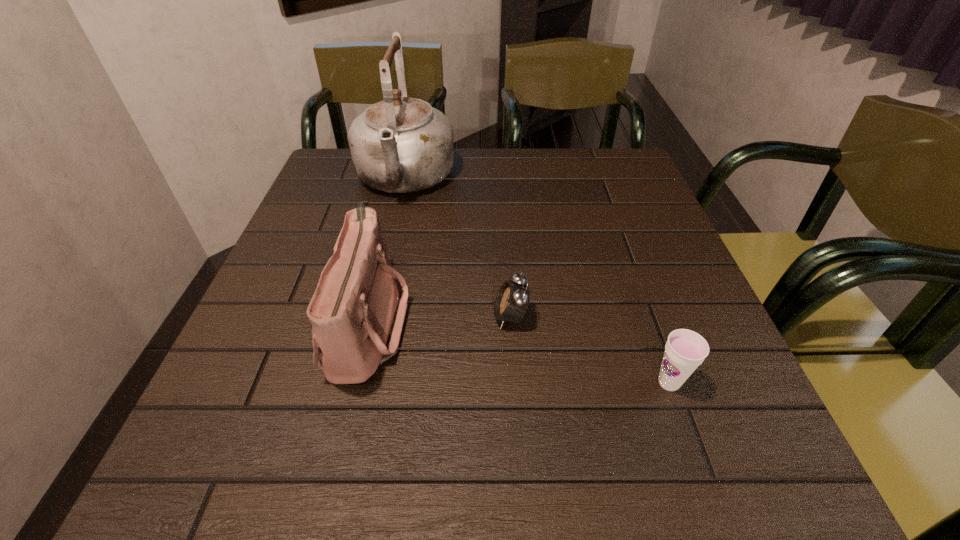
Select which object is the third closest to the tallest object. Please provide its 2D coordinates. Your answer should be formatted as a tuple, i.e. [(x, y)], where the tuple contains the x and y coordinates of a point satisfying the conditions above.

[(685, 350)]

Identify which object is the third closest to the cup. Please provide its 2D coordinates. Your answer should be formatted as a tuple, i.e. [(x, y)], where the tuple contains the x and y coordinates of a point satisfying the conditions above.

[(399, 145)]

At what (x,y) coordinates should I click in order to perform the action: click on free point that satisfies the following two spatial constraints: 1. at the spout of the rightmost object; 2. on the left side of the kettle. Please return your answer as a coordinate pair (x, y). This screenshot has width=960, height=540. Looking at the image, I should click on (358, 383).

At what (x,y) coordinates should I click in order to perform the action: click on free space that satisfies the following two spatial constraints: 1. at the spout of the kettle; 2. on the front pocket of the third shortest object. Please return your answer as a coordinate pair (x, y). Looking at the image, I should click on (372, 322).

This screenshot has height=540, width=960. I want to click on vacant region that satisfies the following two spatial constraints: 1. on the front pocket of the rightmost object; 2. on the left side of the third shortest object, so coord(353,383).

At what (x,y) coordinates should I click in order to perform the action: click on vacant point that satisfies the following two spatial constraints: 1. at the spout of the tallest object; 2. on the left side of the rightmost object. Please return your answer as a coordinate pair (x, y). Looking at the image, I should click on (358, 383).

Where is `free space that satisfies the following two spatial constraints: 1. at the spout of the kettle; 2. on the front pocket of the shoulder bag`? free space that satisfies the following two spatial constraints: 1. at the spout of the kettle; 2. on the front pocket of the shoulder bag is located at coordinates (372, 322).